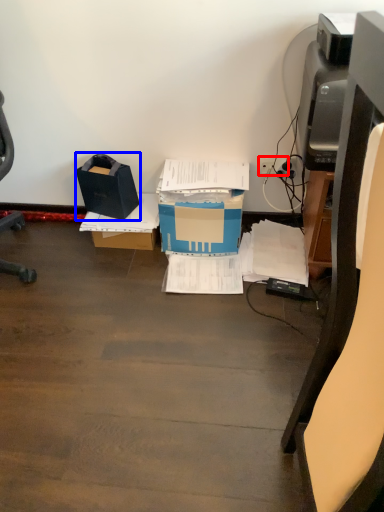
Question: Which point is closer to the camera, plug (highlighted by a red box) or box (highlighted by a blue box)?

Choices:
 (A) plug
 (B) box

Answer: (B)